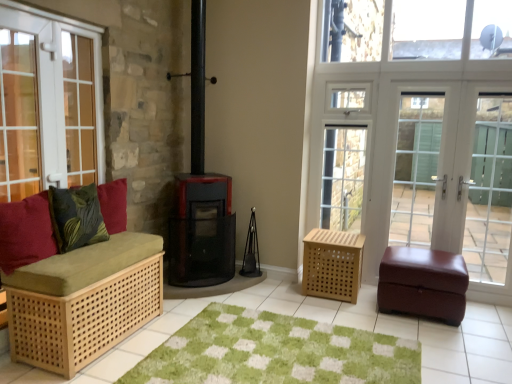
Question: In terms of height, does white glass screen door at right, which ranks as the 1th screen door in right-to-left order, look taller or shorter compared to white glass door at left?

Choices:
 (A) short
 (B) tall

Answer: (B)

Question: Considering the positions of point (494, 256) and point (98, 82), is point (494, 256) closer or farther from the camera than point (98, 82)?

Choices:
 (A) farther
 (B) closer

Answer: (A)

Question: Estimate the real-world distances between objects in this image. Which object is farther from the green textured mat at center?

Choices:
 (A) black mesh wood burning stove at center
 (B) matte white screen door at right, the 2th screen door in the right-to-left sequence
 (C) natural wood bench at left, the first furniture viewed from the left
 (D) burgundy leather ottoman at right, arranged as the 1th furniture when viewed from the right
 (E) velvet red cushion at left, the second pillow in the back-to-front sequence

Answer: (B)

Question: Estimate the real-world distances between objects in this image. Which object is farther from the black mesh wood burning stove at center?

Choices:
 (A) white glass screen door at right, the 3th screen door viewed from the left
 (B) green textured mat at center
 (C) white glass door at left
 (D) velvet red cushion at left, which ranks as the 1th pillow in front-to-back order
 (E) light brown woven basket at center-right, the second furniture when ordered from right to left

Answer: (A)